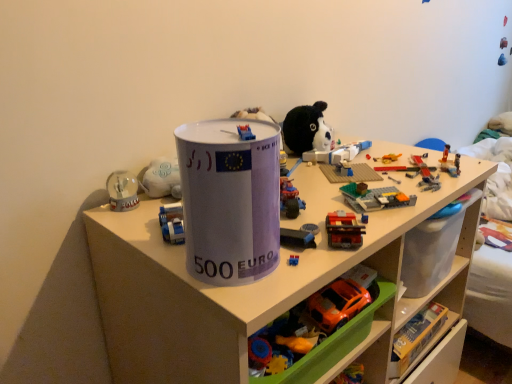
Question: Does brick-like plastic train at center-right, the second toy positioned from the top, have a larger size compared to white plastic shelf at center?

Choices:
 (A) no
 (B) yes

Answer: (A)

Question: Is brick-like plastic train at center-right, the second toy positioned from the top, positioned far away from white plastic shelf at center?

Choices:
 (A) no
 (B) yes

Answer: (A)

Question: From a real-world perspective, is brick-like plastic train at center-right, the second toy positioned from the top, located higher than white plastic shelf at center?

Choices:
 (A) no
 (B) yes

Answer: (B)

Question: Is brick-like plastic train at center-right, the second toy positioned from the top, facing away from white plastic shelf at center?

Choices:
 (A) yes
 (B) no

Answer: (B)

Question: Is brick-like plastic train at center-right, the third toy when ordered from bottom to top, beside white plastic shelf at center?

Choices:
 (A) no
 (B) yes

Answer: (A)

Question: Is brick-like plastic train at center-right, the third toy when ordered from bottom to top, taller or shorter than rubberized plastic toy car at center, which appears as the 4th toy when ordered from the bottom?

Choices:
 (A) short
 (B) tall

Answer: (A)

Question: Considering their positions, is brick-like plastic train at center-right, the second toy positioned from the top, located in front of or behind rubberized plastic toy car at center, which is the 1th toy from top to bottom?

Choices:
 (A) front
 (B) behind

Answer: (A)

Question: Is brick-like plastic train at center-right, the second toy positioned from the top, spatially inside rubberized plastic toy car at center, which appears as the 4th toy when ordered from the bottom, or outside of it?

Choices:
 (A) outside
 (B) inside

Answer: (A)

Question: Considering the positions of brick-like plastic train at center-right, the second toy positioned from the top, and rubberized plastic toy car at center, which appears as the 4th toy when ordered from the bottom, in the image, is brick-like plastic train at center-right, the second toy positioned from the top, bigger or smaller than rubberized plastic toy car at center, which appears as the 4th toy when ordered from the bottom,?

Choices:
 (A) small
 (B) big

Answer: (A)

Question: In terms of height, does orange plastic car at lower center, the first toy in the bottom-to-top sequence, look taller or shorter compared to rubberized plastic toy car at center, which is the 1th toy from top to bottom?

Choices:
 (A) short
 (B) tall

Answer: (B)

Question: Looking at their shapes, would you say orange plastic car at lower center, the first toy in the bottom-to-top sequence, is wider or thinner than rubberized plastic toy car at center, which is the 1th toy from top to bottom?

Choices:
 (A) wide
 (B) thin

Answer: (A)

Question: Considering the positions of point (330, 365) and point (287, 203), is point (330, 365) closer or farther from the camera than point (287, 203)?

Choices:
 (A) closer
 (B) farther

Answer: (A)

Question: Considering the relative positions of orange plastic car at lower center, the first toy in the bottom-to-top sequence, and rubberized plastic toy car at center, which is the 1th toy from top to bottom, in the image provided, is orange plastic car at lower center, the first toy in the bottom-to-top sequence, to the left or to the right of rubberized plastic toy car at center, which is the 1th toy from top to bottom,?

Choices:
 (A) right
 (B) left

Answer: (A)

Question: Considering the positions of white plastic shelf at center and orange plastic car at lower center, the fourth toy positioned from the top, in the image, is white plastic shelf at center taller or shorter than orange plastic car at lower center, the fourth toy positioned from the top,?

Choices:
 (A) tall
 (B) short

Answer: (A)

Question: Is white plastic shelf at center wider or thinner than orange plastic car at lower center, the fourth toy positioned from the top?

Choices:
 (A) wide
 (B) thin

Answer: (A)